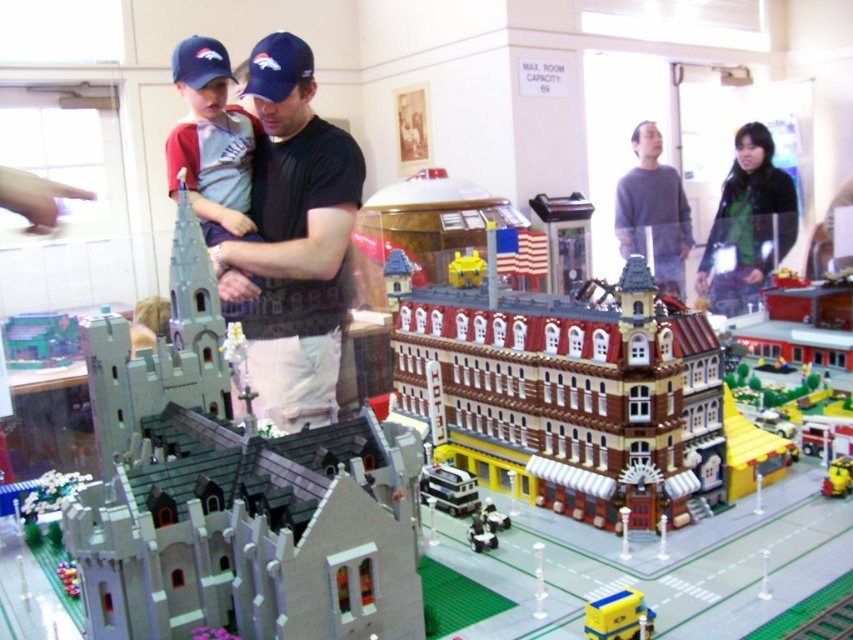
Consider the image. Which of these two, green matte castle at lower left or yellow matte toy car at lower center, stands shorter?

With less height is yellow matte toy car at lower center.

Measure the distance from green matte castle at lower left to yellow matte toy car at lower center.

They are 1.80 meters apart.

Identify the location of green matte castle at lower left. (39, 339).

Between matte blue cap at center and matte blue baseball cap at upper left, which one appears on the right side from the viewer's perspective?

From the viewer's perspective, matte blue cap at center appears more on the right side.

Which is behind, point (192, 150) or point (173, 74)?

Point (192, 150)

At what (x,y) coordinates should I click in order to perform the action: click on matte blue cap at center. Please return your answer as a coordinate pair (x, y). Image resolution: width=853 pixels, height=640 pixels. Looking at the image, I should click on (212, 141).

Can you confirm if black fabric shirt at center is positioned below yellow matte toy car at lower center?

Actually, black fabric shirt at center is above yellow matte toy car at lower center.

Is black fabric shirt at center closer to camera compared to yellow matte toy car at lower center?

No, it is not.

Does point (279, 394) come farther from viewer compared to point (608, 600)?

That is True.

The height and width of the screenshot is (640, 853). I want to click on black fabric shirt at center, so click(x=294, y=241).